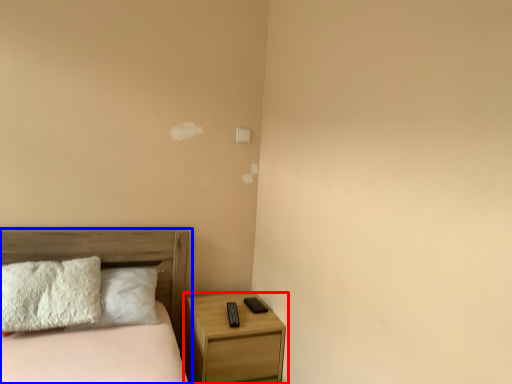
Question: Which of the following is the farthest to the observer, nightstand (highlighted by a red box) or bed (highlighted by a blue box)?

Choices:
 (A) nightstand
 (B) bed

Answer: (A)